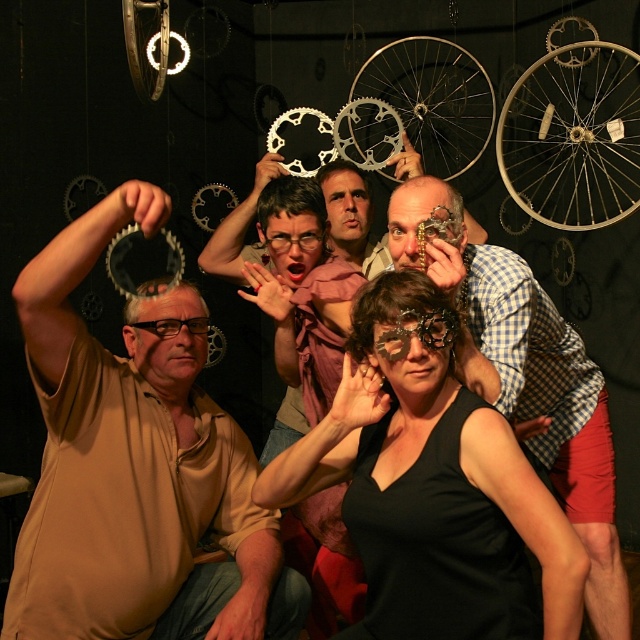
Question: Is silver metallic bicycle wheel at center closer to camera compared to matte brown head at center?

Choices:
 (A) yes
 (B) no

Answer: (B)

Question: Considering the real-world distances, which object is closest to the matte brown head at center?

Choices:
 (A) silver metallic bicycle wheel at center
 (B) black matte mask at center
 (C) matte pink fabric at center

Answer: (C)

Question: Can you confirm if white metallic bicycle wheel at upper right is positioned above black matte mask at center?

Choices:
 (A) yes
 (B) no

Answer: (A)

Question: Among these points, which one is farthest from the camera?

Choices:
 (A) (291, 262)
 (B) (164, 442)

Answer: (A)

Question: Where is matte gold shirt at center located in relation to black matte mask at center in the image?

Choices:
 (A) below
 (B) above

Answer: (A)

Question: Among these points, which one is farthest from the camera?

Choices:
 (A) (420, 81)
 (B) (132, 612)
 (C) (577, 132)

Answer: (A)